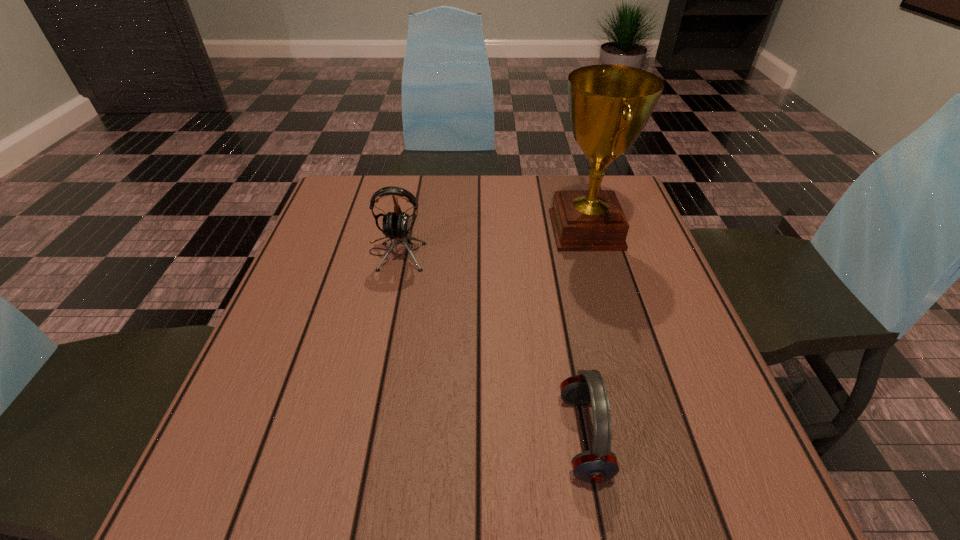
Identify the location of the tallest object. (609, 105).

Identify the location of the taller earphone. This screenshot has height=540, width=960. (396, 225).

The height and width of the screenshot is (540, 960). What are the coordinates of `the second tallest object` in the screenshot? It's located at (396, 225).

Identify the location of the right earphone. Image resolution: width=960 pixels, height=540 pixels. (599, 465).

The height and width of the screenshot is (540, 960). In order to click on the nearest object in this screenshot , I will do tap(599, 465).

The width and height of the screenshot is (960, 540). Find the location of `vacant area situated 0.350m on the plaque of the award`. vacant area situated 0.350m on the plaque of the award is located at coordinates (411, 230).

At what (x,y) coordinates should I click in order to perform the action: click on free space located 0.050m on the plaque of the award. Please return your answer as a coordinate pair (x, y). Looking at the image, I should click on (529, 230).

Locate an element on the screen. free region located on the plaque of the award is located at coordinates (458, 230).

Where is `vacant position located on the left of the farther earphone`? The width and height of the screenshot is (960, 540). vacant position located on the left of the farther earphone is located at coordinates (313, 253).

Identify the location of vacant region located 0.140m on the ear cups of the shorter earphone. The image size is (960, 540). (476, 437).